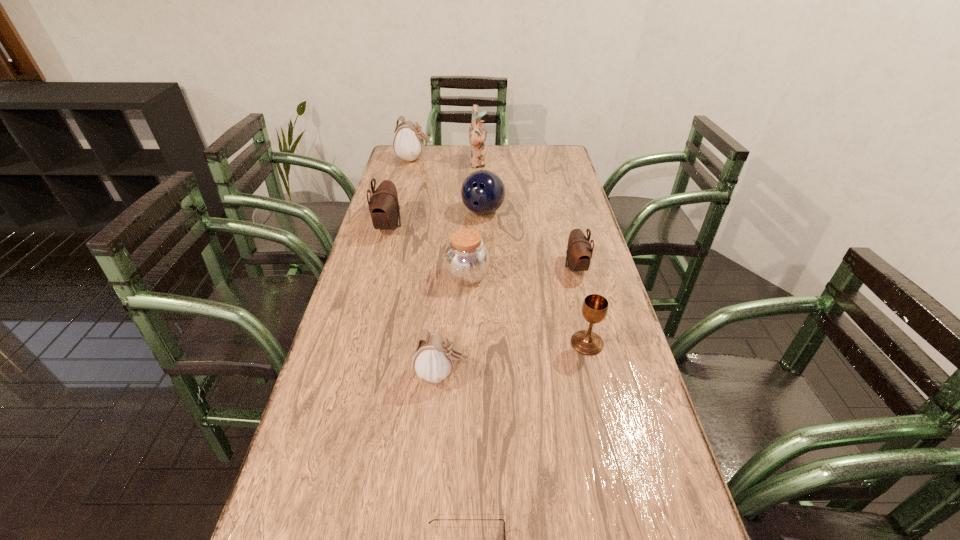
Where is `free space located with the flap open on the smaller brown pouch`? free space located with the flap open on the smaller brown pouch is located at coordinates (482, 267).

Locate an element on the screen. This screenshot has width=960, height=540. blank space located 0.050m with the flap open on the smaller brown pouch is located at coordinates (548, 267).

The height and width of the screenshot is (540, 960). I want to click on free region located with the flap open on the smaller brown pouch, so click(x=452, y=267).

Locate an element on the screen. This screenshot has height=540, width=960. figurine that is at the far edge is located at coordinates (477, 135).

The height and width of the screenshot is (540, 960). Identify the location of pouch that is at the far edge. [408, 142].

This screenshot has height=540, width=960. In order to click on chalice that is at the right edge in this screenshot , I will do `click(595, 307)`.

Locate an element on the screen. The height and width of the screenshot is (540, 960). pouch that is at the right edge is located at coordinates (579, 251).

The width and height of the screenshot is (960, 540). In order to click on object that is at the far left corner in this screenshot , I will do `click(408, 142)`.

The height and width of the screenshot is (540, 960). In order to click on free region at the far edge of the desktop in this screenshot , I will do `click(493, 150)`.

In the image, there is a desktop. At what (x,y) coordinates should I click in order to perform the action: click on vacant space at the left edge. Please return your answer as a coordinate pair (x, y). This screenshot has width=960, height=540. Looking at the image, I should click on (387, 178).